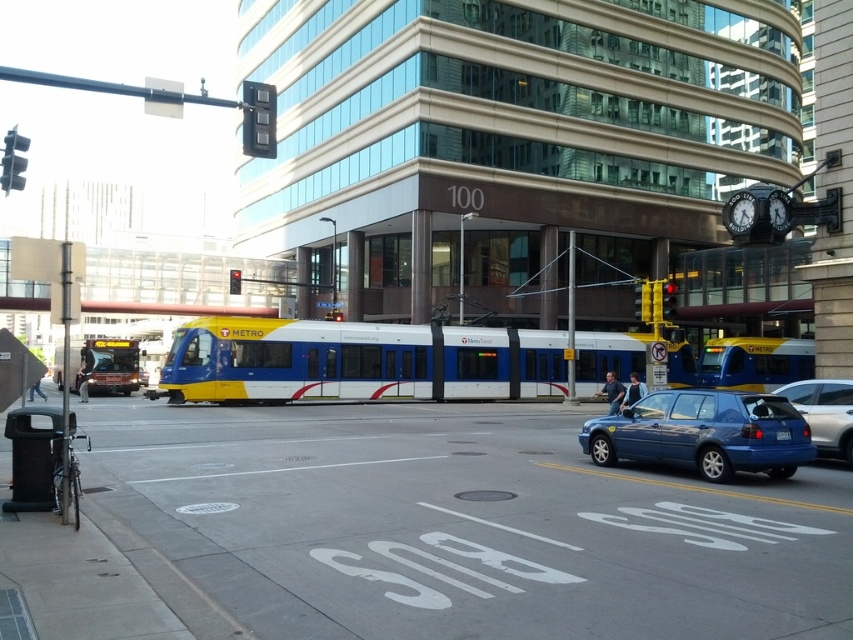
Question: From the image, what is the correct spatial relationship of white glossy train at center in relation to metallic blue sedan at lower right?

Choices:
 (A) left
 (B) right

Answer: (A)

Question: Which point is farther from the camera taking this photo?

Choices:
 (A) (666, 317)
 (B) (229, 291)

Answer: (B)

Question: Does metallic blue sedan at lower right have a larger size compared to yellow plastic traffic light at center?

Choices:
 (A) no
 (B) yes

Answer: (A)

Question: Is black plastic traffic light at left smaller than yellow plastic traffic light at upper right?

Choices:
 (A) no
 (B) yes

Answer: (A)

Question: Estimate the real-world distances between objects in this image. Which object is farther from the metallic blue sedan at lower right?

Choices:
 (A) yellow plastic traffic light at upper center
 (B) yellow plastic traffic light at center

Answer: (A)

Question: Based on their relative distances, which object is nearer to the black plastic traffic light at upper center?

Choices:
 (A) white glossy train at center
 (B) yellow metallic traffic light at upper center
 (C) black plastic traffic light at left

Answer: (B)